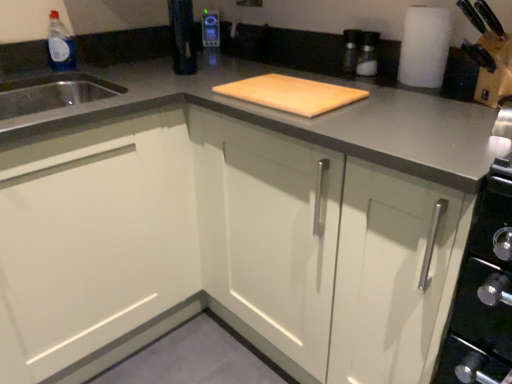
Find the location of a particular element. The image size is (512, 384). free space in front of white matte paper towel at upper right is located at coordinates (406, 101).